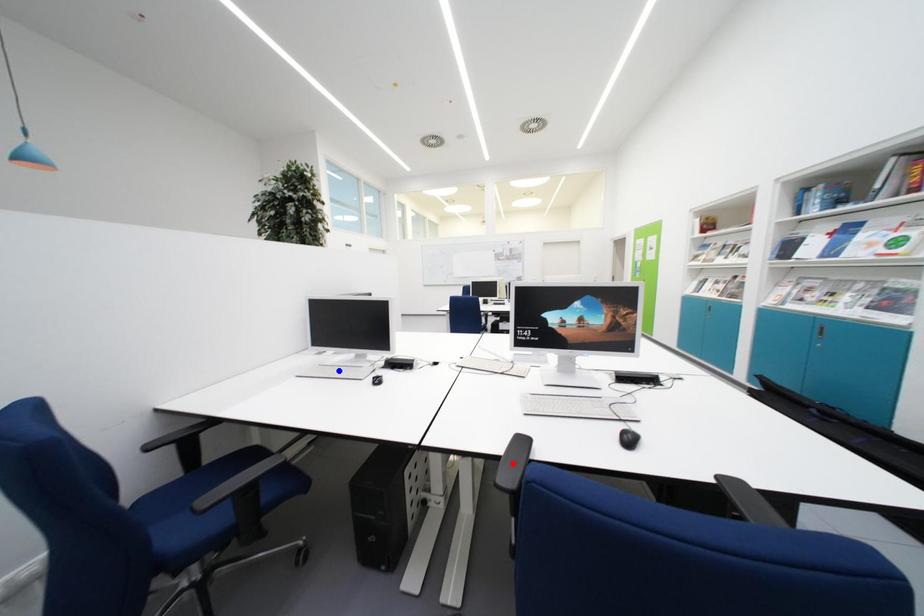
Question: Which of the two points in the image is closer to the camera?

Choices:
 (A) Blue point is closer.
 (B) Red point is closer.

Answer: (B)